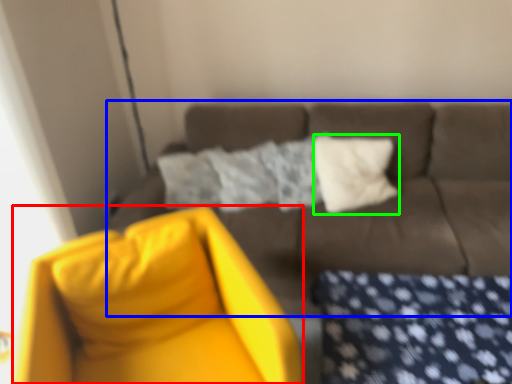
Question: Estimate the real-world distances between objects in this image. Which object is closer to swivel chair (highlighted by a red box), studio couch (highlighted by a blue box) or pillow (highlighted by a green box)?

Choices:
 (A) studio couch
 (B) pillow

Answer: (A)